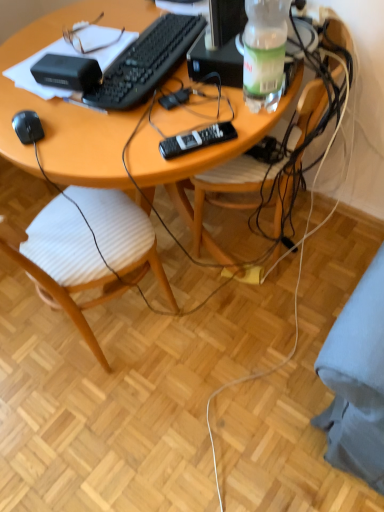
You are a GUI agent. You are given a task and a screenshot of the screen. Output one action in this format:
    pyautogui.click(x=<x>, y=<y>)
    Task: Click on the free space in front of wooden desk at center
    The image size is (384, 512).
    Given the screenshot: What is the action you would take?
    pyautogui.click(x=181, y=409)